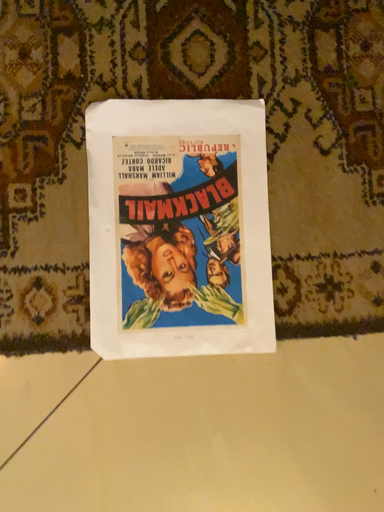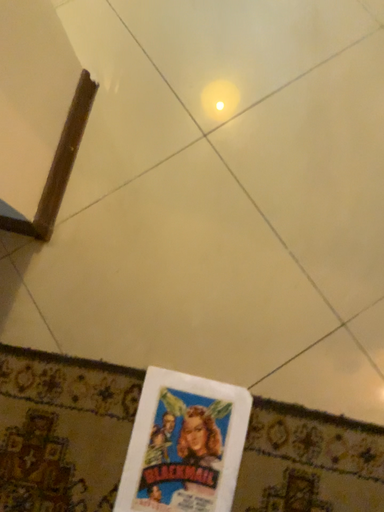
Question: Which way did the camera rotate in the video?

Choices:
 (A) rotated downward
 (B) rotated upward

Answer: (B)